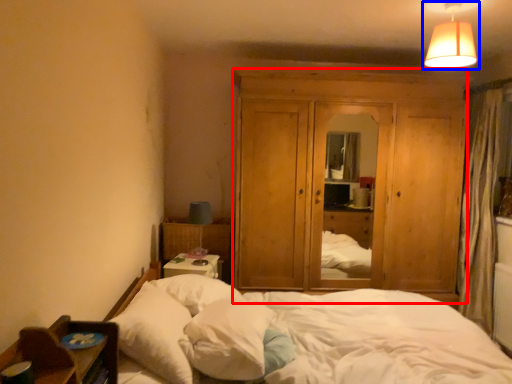
Question: Which of the following is the farthest to the observer, dresser (highlighted by a red box) or lamp (highlighted by a blue box)?

Choices:
 (A) dresser
 (B) lamp

Answer: (A)